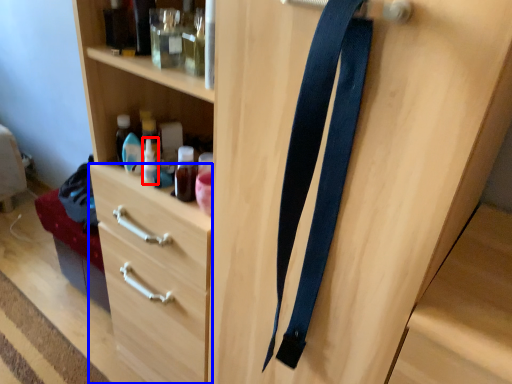
Question: Which object appears closest to the camera in this image, bottle (highlighted by a red box) or drawer (highlighted by a blue box)?

Choices:
 (A) bottle
 (B) drawer

Answer: (A)